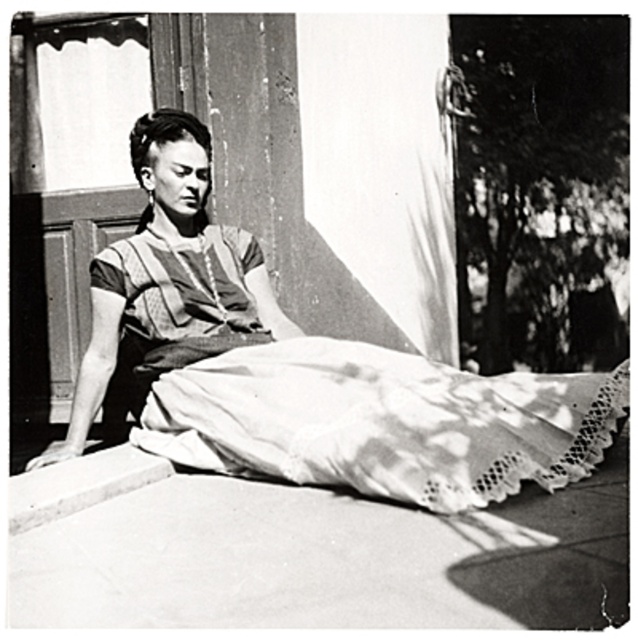
Question: Which point is farther to the camera?

Choices:
 (A) matte fabric dress at center
 (B) smooth concrete curb at lower left

Answer: (B)

Question: Does matte fabric dress at center appear on the right side of smooth concrete curb at lower left?

Choices:
 (A) yes
 (B) no

Answer: (A)

Question: Does matte fabric dress at center appear on the left side of smooth concrete curb at lower left?

Choices:
 (A) no
 (B) yes

Answer: (A)

Question: Does matte fabric dress at center have a smaller size compared to smooth concrete curb at lower left?

Choices:
 (A) no
 (B) yes

Answer: (A)

Question: Which object is closer to the camera taking this photo?

Choices:
 (A) matte fabric dress at center
 (B) smooth concrete curb at lower left

Answer: (A)